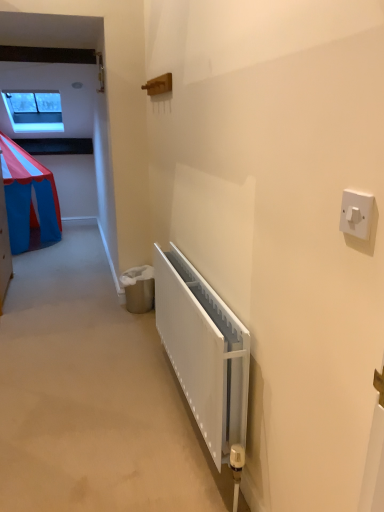
Question: Would you say white matte radiator at lower center is inside or outside transparent glass window at upper left?

Choices:
 (A) outside
 (B) inside

Answer: (A)

Question: From a real-world perspective, relative to transparent glass window at upper left, is white matte radiator at lower center vertically above or below?

Choices:
 (A) below
 (B) above

Answer: (A)

Question: Considering the real-world distances, which object is closest to the white matte radiator at lower center?

Choices:
 (A) transparent glass window at upper left
 (B) white plastic light switch at upper right

Answer: (B)

Question: Estimate the real-world distances between objects in this image. Which object is closer to the white matte radiator at lower center?

Choices:
 (A) transparent glass window at upper left
 (B) white plastic light switch at upper right

Answer: (B)